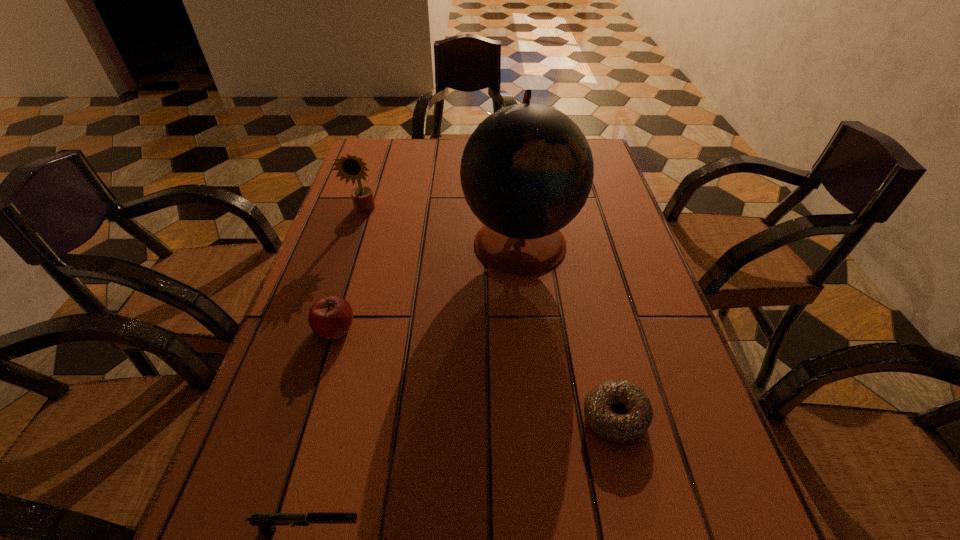
Identify the location of vacant space located with the Americas facing the viewer on the globe. The height and width of the screenshot is (540, 960). (330, 241).

This screenshot has width=960, height=540. I want to click on vacant region located 0.400m on the face of the sunflower, so click(323, 340).

Where is `free space located on the back of the third farthest object`? free space located on the back of the third farthest object is located at coordinates (367, 223).

This screenshot has width=960, height=540. In order to click on vacant region located 0.170m at the muzzle end of the fourth tallest object in this screenshot , I will do `click(481, 530)`.

This screenshot has height=540, width=960. What are the coordinates of `vacant space situated on the right of the shortest object` in the screenshot? It's located at (695, 417).

You are a GUI agent. You are given a task and a screenshot of the screen. Output one action in this format:
    pyautogui.click(x=<x>, y=<y>)
    Task: Click on the sunflower at the left edge
    This screenshot has width=960, height=540.
    Given the screenshot: What is the action you would take?
    pyautogui.click(x=348, y=167)

At what (x,y) coordinates should I click in order to perform the action: click on apple present at the left edge. Please return your answer as a coordinate pair (x, y). The width and height of the screenshot is (960, 540). Looking at the image, I should click on (331, 317).

Locate an element on the screen. gun that is at the left edge is located at coordinates (266, 522).

I want to click on globe located in the right edge section of the desktop, so 526,172.

Locate an element on the screen. The width and height of the screenshot is (960, 540). doughnut present at the right edge is located at coordinates (618, 411).